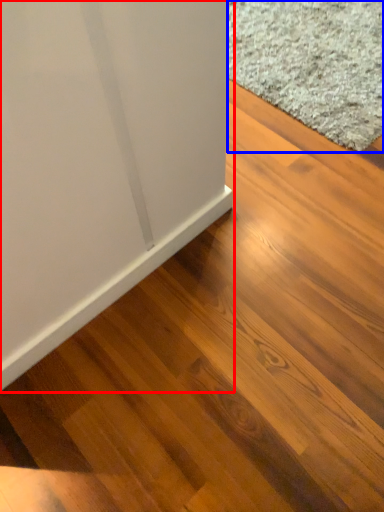
Question: Which of the following is the farthest to the observer, furniture (highlighted by a red box) or doormat (highlighted by a blue box)?

Choices:
 (A) furniture
 (B) doormat

Answer: (B)